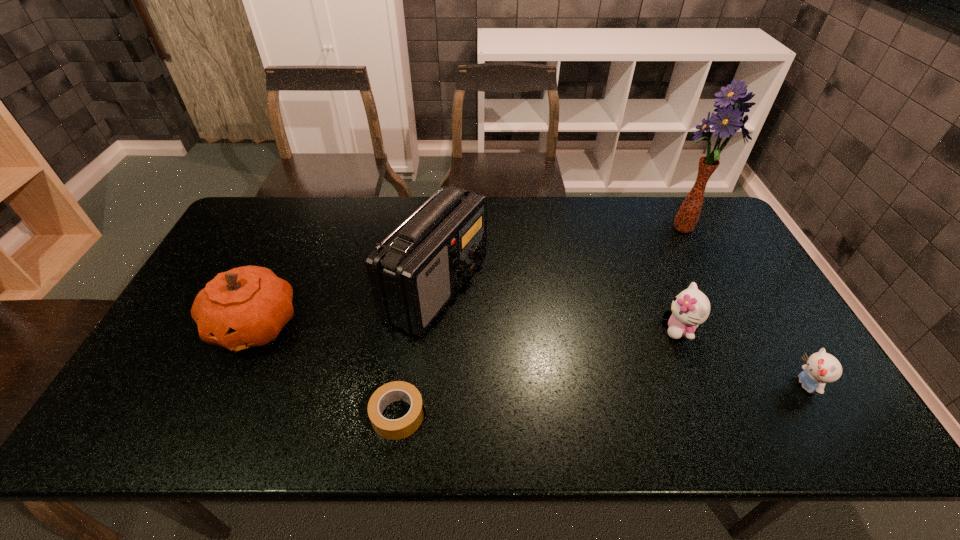
Image resolution: width=960 pixels, height=540 pixels. Identify the location of the tallest object. (729, 119).

Where is `radio receiver`? The width and height of the screenshot is (960, 540). radio receiver is located at coordinates (415, 272).

Find the location of a particular element. The width and height of the screenshot is (960, 540). the fourth shortest object is located at coordinates (248, 306).

At what (x,y) coordinates should I click in order to perform the action: click on pumpkin. Please return your answer as a coordinate pair (x, y). This screenshot has width=960, height=540. Looking at the image, I should click on (248, 306).

The image size is (960, 540). I want to click on the fourth tallest object, so tap(690, 308).

Where is `the farther kitten`? The width and height of the screenshot is (960, 540). the farther kitten is located at coordinates (690, 308).

Find the location of a particular element. This screenshot has height=540, width=960. the nearer kitten is located at coordinates point(821,368).

Identify the location of the fifth tallest object. This screenshot has height=540, width=960. (821, 368).

The image size is (960, 540). I want to click on the shortest object, so click(397, 429).

At what (x,y) coordinates should I click in order to perform the action: click on vacant position located 0.310m on the left of the tallest object. Please return your answer as a coordinate pair (x, y). The height and width of the screenshot is (540, 960). Looking at the image, I should click on (562, 229).